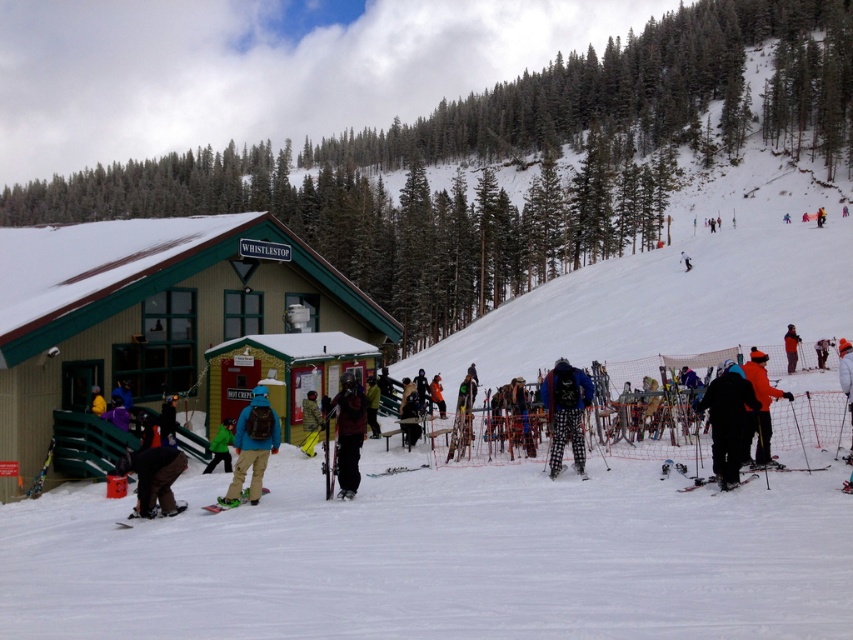
Between plaid pants at center and dark gray ski pants at center, which one has less height?

With less height is plaid pants at center.

Locate an element on the screen. The width and height of the screenshot is (853, 640). plaid pants at center is located at coordinates [x=566, y=410].

Does black matte jacket at center have a larger size compared to orange ski jacket at center?

Indeed, black matte jacket at center has a larger size compared to orange ski jacket at center.

How distant is black matte jacket at center from orange ski jacket at center?

black matte jacket at center and orange ski jacket at center are 1.02 meters apart from each other.

Who is more distant from viewer, (740, 406) or (759, 404)?

Positioned behind is point (759, 404).

You are a GUI agent. You are given a task and a screenshot of the screen. Output one action in this format:
    pyautogui.click(x=<x>, y=<y>)
    Task: Click on the black matte jacket at center
    
    Given the screenshot: What is the action you would take?
    pyautogui.click(x=727, y=420)

Who is positioned more to the left, matte blue snowboarder at center or green matte jacket at center?

From the viewer's perspective, green matte jacket at center appears more on the left side.

What do you see at coordinates (252, 445) in the screenshot? The image size is (853, 640). I see `matte blue snowboarder at center` at bounding box center [252, 445].

Locate an element on the screen. matte blue snowboarder at center is located at coordinates (252, 445).